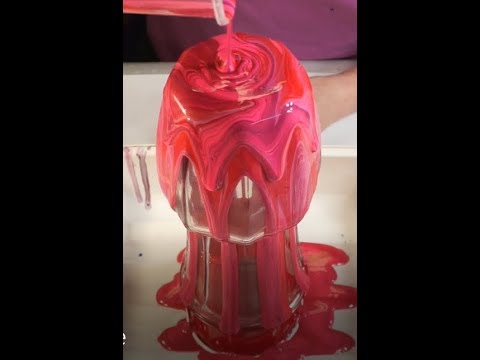
Locate an element on the screen. white surface is located at coordinates (141, 244).